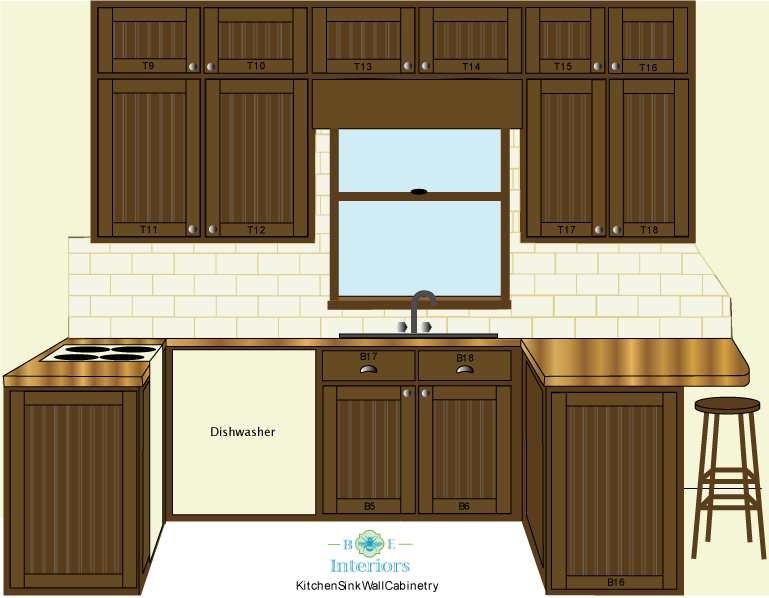
In order to click on cabinets in this screenshot , I will do `click(614, 489)`, `click(418, 434)`, `click(98, 469)`, `click(200, 145)`, `click(227, 44)`, `click(404, 30)`, `click(611, 28)`, `click(607, 152)`.